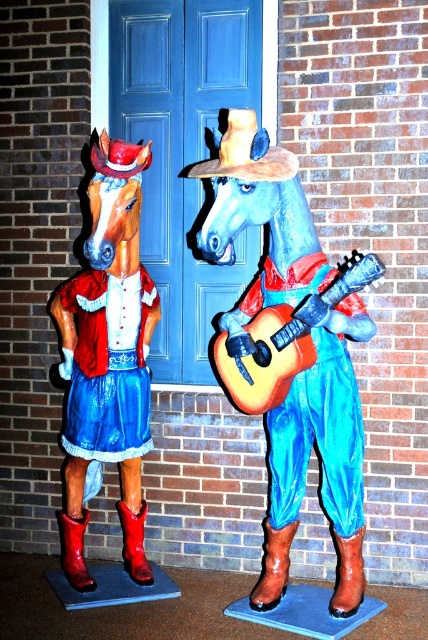
Question: Considering the real-world distances, which object is farthest from the brown felt cowboy hat at center?

Choices:
 (A) matte red fabric horse at left
 (B) wooden acoustic guitar at center
 (C) blue satin dress at left
 (D) matte blue horse at center

Answer: (C)

Question: Is brown leather boot at lower right bigger than rubber matte boot at lower right?

Choices:
 (A) no
 (B) yes

Answer: (B)

Question: Which of the following is the closest to the observer?

Choices:
 (A) matte blue horse at center
 (B) rubber boot at lower left

Answer: (A)

Question: Is the position of matte blue horse at center more distant than that of rubber boot at lower left?

Choices:
 (A) no
 (B) yes

Answer: (A)

Question: Can you confirm if matte blue horse at center is positioned above wooden acoustic guitar at center?

Choices:
 (A) no
 (B) yes

Answer: (A)

Question: Which of these objects is positioned closest to the matte red fabric horse at left?

Choices:
 (A) red matte boot at lower left
 (B) blue satin dress at left

Answer: (B)